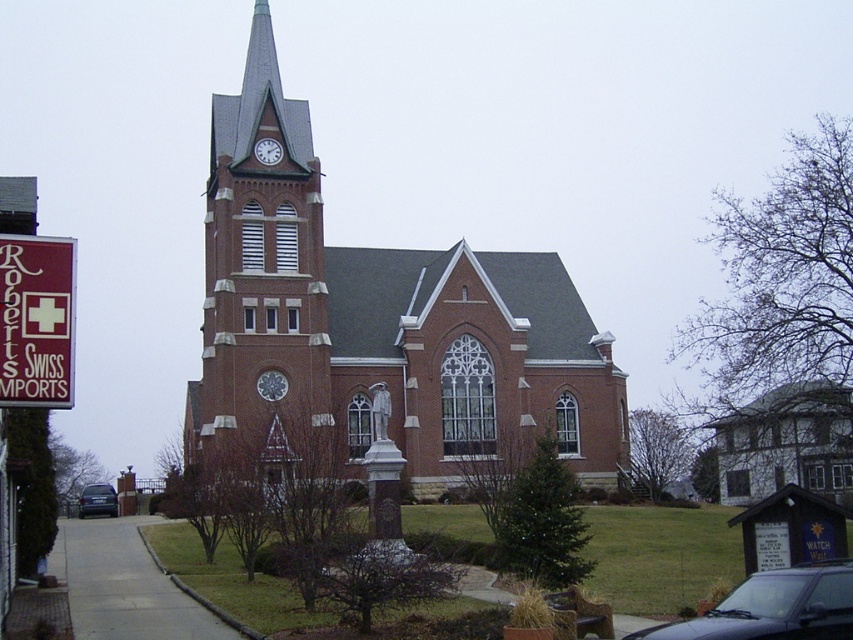
Question: Is maroon fabric sign at left to the right of white wooden clock at upper center from the viewer's perspective?

Choices:
 (A) no
 (B) yes

Answer: (A)

Question: Among these objects, which one is nearest to the camera?

Choices:
 (A) metallic blue sedan at center
 (B) white wooden clock at upper center
 (C) metallic clock at center

Answer: (C)

Question: Which of the following is the farthest from the observer?

Choices:
 (A) (734, 592)
 (B) (10, 257)

Answer: (A)

Question: Is brick church at center closer to camera compared to brick steeple at center?

Choices:
 (A) no
 (B) yes

Answer: (A)

Question: Is maroon fabric sign at left below black glossy car at lower right?

Choices:
 (A) yes
 (B) no

Answer: (B)

Question: Which object is farther from the camera taking this photo?

Choices:
 (A) metallic blue sedan at center
 (B) black glossy car at lower right
 (C) metallic clock at center

Answer: (A)